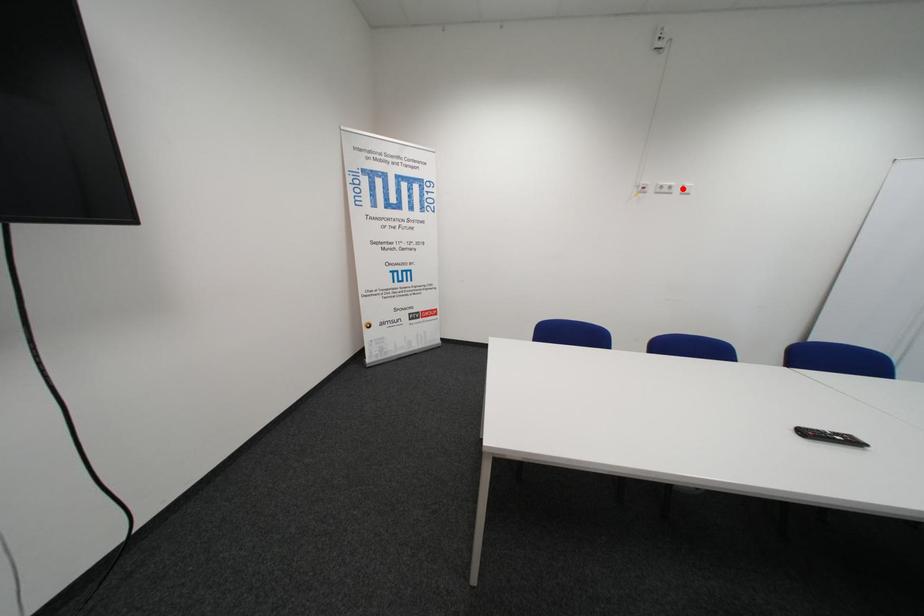
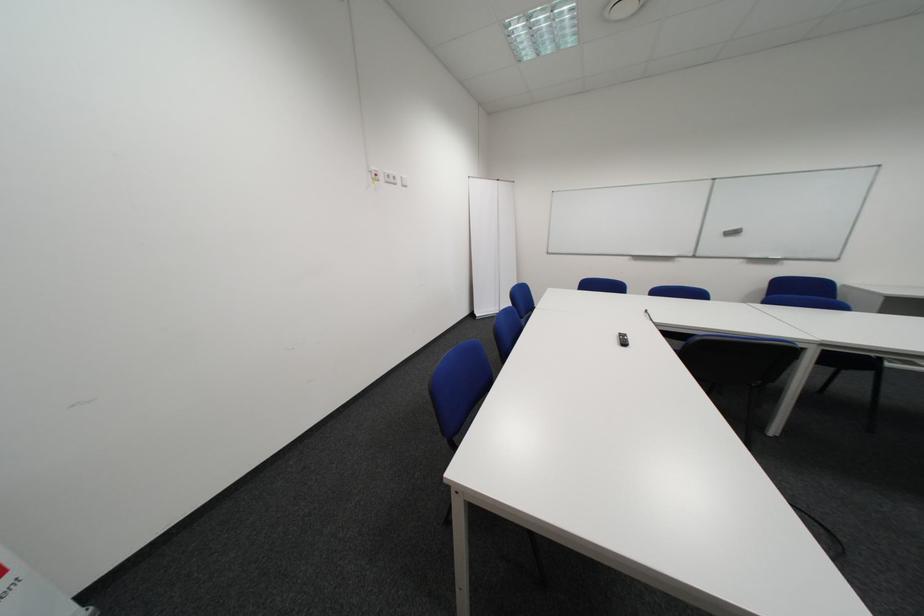
The point at the highlighted location is marked in the first image. Where is the corresponding point in the second image?

(407, 179)